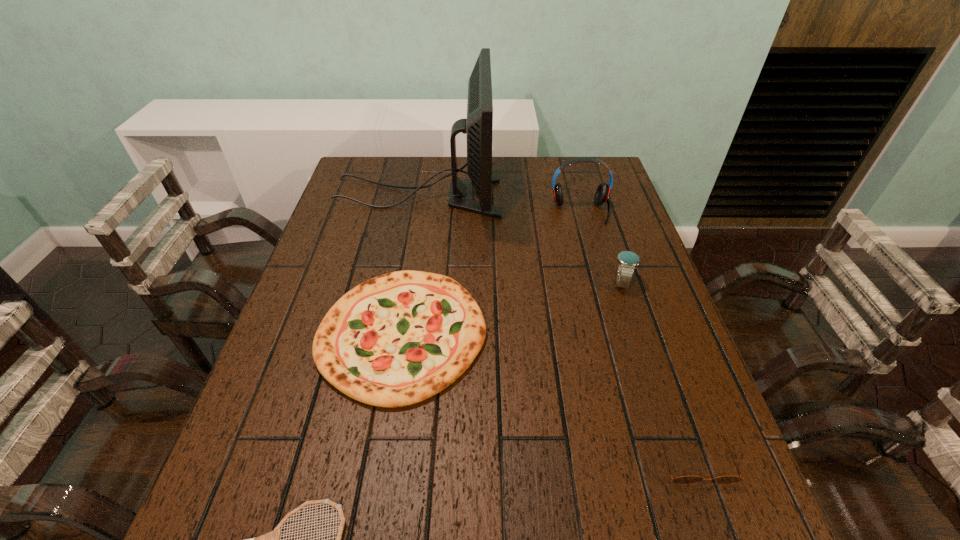
The image size is (960, 540). Identify the location of object at the far edge. (478, 126).

Locate an element on the screen. This screenshot has width=960, height=540. computer monitor that is positioned at the left edge is located at coordinates (478, 126).

Where is `pizza that is at the left edge`? pizza that is at the left edge is located at coordinates (397, 339).

This screenshot has width=960, height=540. Identify the location of headset situated at the right edge. (602, 193).

Where is `watch that is at the right edge`? This screenshot has height=540, width=960. watch that is at the right edge is located at coordinates [x=627, y=260].

Image resolution: width=960 pixels, height=540 pixels. Find the location of `sunglasses at the right edge`. sunglasses at the right edge is located at coordinates (684, 479).

Find the location of a particular element. This screenshot has height=540, width=960. object situated at the far left corner is located at coordinates (478, 126).

I want to click on free space at the far edge of the desktop, so pos(537,159).

I want to click on free space at the near edge of the desktop, so click(331, 515).

In the image, there is a desktop. At what (x,y) coordinates should I click in order to perform the action: click on blank space at the left edge. Please return your answer as a coordinate pair (x, y). The image size is (960, 540). Looking at the image, I should click on (326, 299).